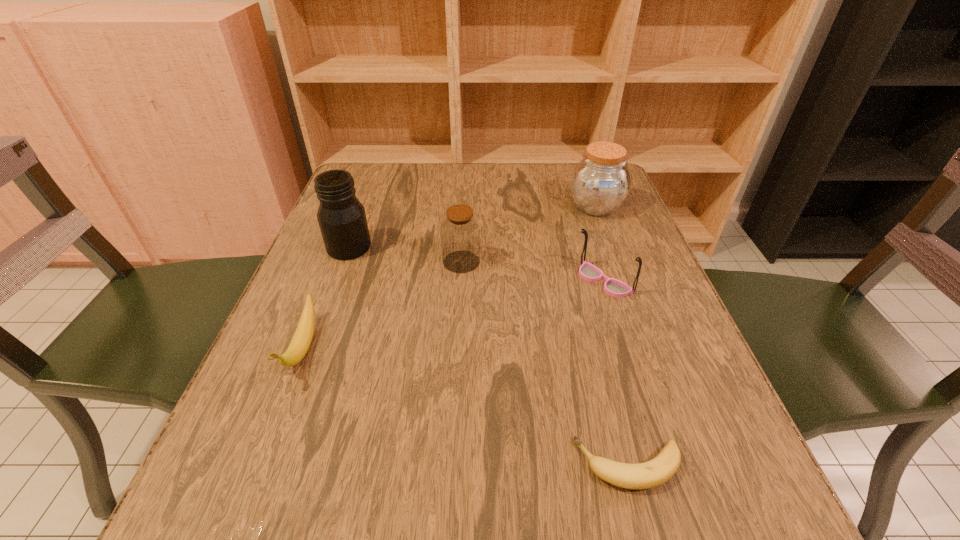
Identify the location of the leftmost jar. Image resolution: width=960 pixels, height=540 pixels. (342, 220).

Locate an element on the screen. the farthest object is located at coordinates (601, 181).

I want to click on the farthest jar, so click(601, 181).

Identify the location of the fourth object from right to left. (460, 232).

At what (x,y) coordinates should I click in order to perform the action: click on the third tallest object. Please return your answer as a coordinate pair (x, y). The height and width of the screenshot is (540, 960). Looking at the image, I should click on (460, 232).

The width and height of the screenshot is (960, 540). What are the coordinates of `spectacles` in the screenshot? It's located at (616, 288).

The image size is (960, 540). What are the coordinates of `the farther banana` in the screenshot? It's located at point(300,343).

Image resolution: width=960 pixels, height=540 pixels. I want to click on the fifth tallest object, so click(300, 343).

At what (x,y) coordinates should I click in order to perform the action: click on the nearer banana. Please return your answer as a coordinate pair (x, y). Looking at the image, I should click on (657, 471).

Locate an element on the screen. Image resolution: width=960 pixels, height=540 pixels. the shorter banana is located at coordinates (657, 471).